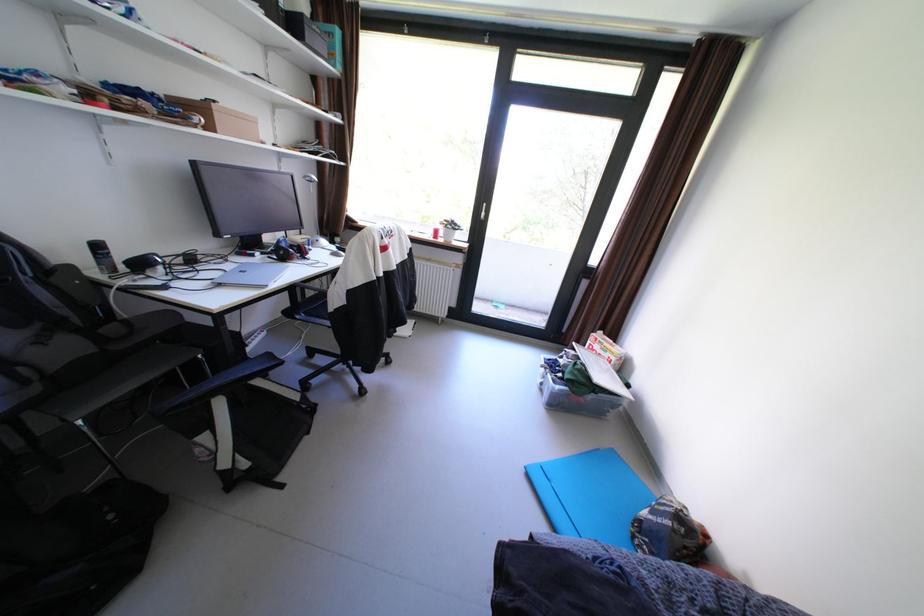
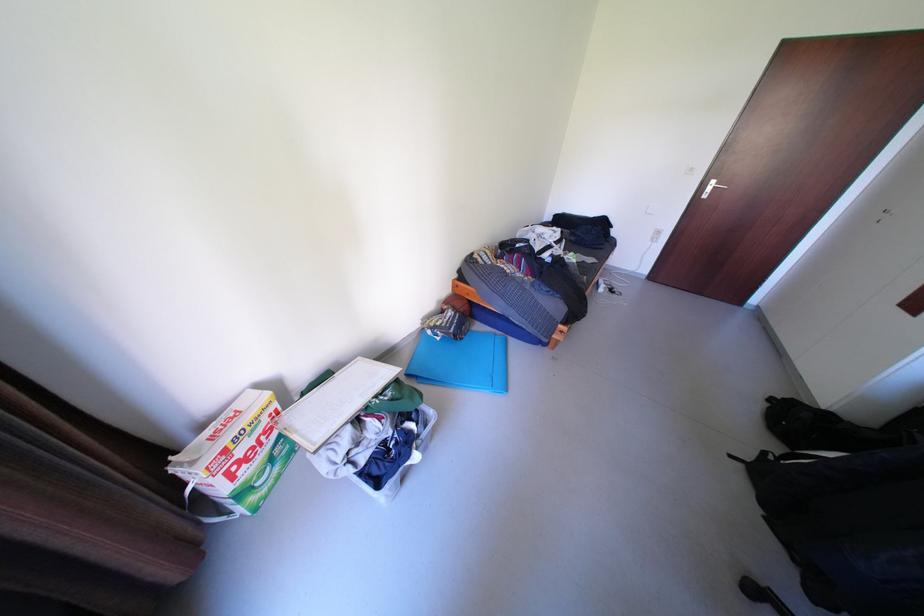
The point at (601,345) is marked in the first image. Where is the corresponding point in the second image?

(237, 474)